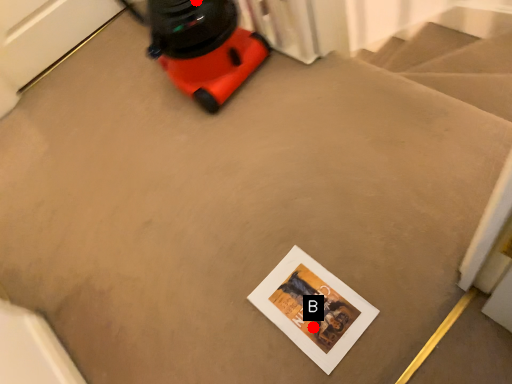
Question: Two points are circled on the image, labeled by A and B beside each circle. Which point is closer to the camera taking this photo?

Choices:
 (A) A is closer
 (B) B is closer

Answer: (B)